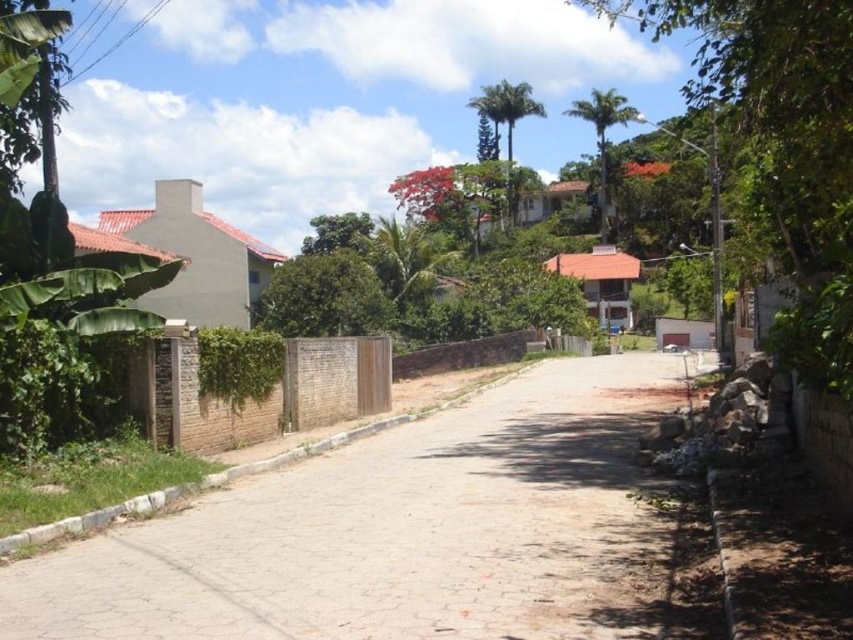
You are standing on the residential street and want to reach the point at coordinates (534, 401). Given that the road is 30 feet wide, is the point on the left side or the right side of the road?

The point at coordinates (534, 401) is 71.31 feet from the viewer, so it is on the right side of the road.

Looking at this image, you are a delivery person trying to navigate a narrow path between the green leafy tree at upper right and the green leafy palm tree at upper center. The path is only 2 meters wide. Can you pass through without touching either tree?

The green leafy tree at upper right might be wider than the green leafy palm tree at upper center. If the tree at upper right is indeed wider than 1 meter, then the combined width of both trees could exceed the 2 meter path, making it difficult to pass without touching them. However, if the tree at upper right is not wider than 1 meter, there might be enough space. Without exact measurements, it is uncertain.